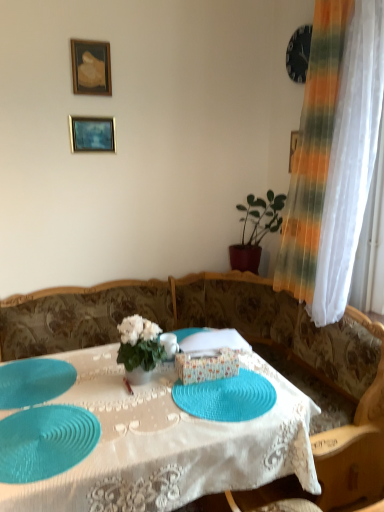
You are a GUI agent. You are given a task and a screenshot of the screen. Output one action in this format:
    pyautogui.click(x=<x>, y=<y>)
    Task: Click on the vacant space situated above teal rubber placemat at lower left, acting as the third glass plate starting from the right (from a real-world perspective)
    The height and width of the screenshot is (512, 384).
    Given the screenshot: What is the action you would take?
    pyautogui.click(x=34, y=374)